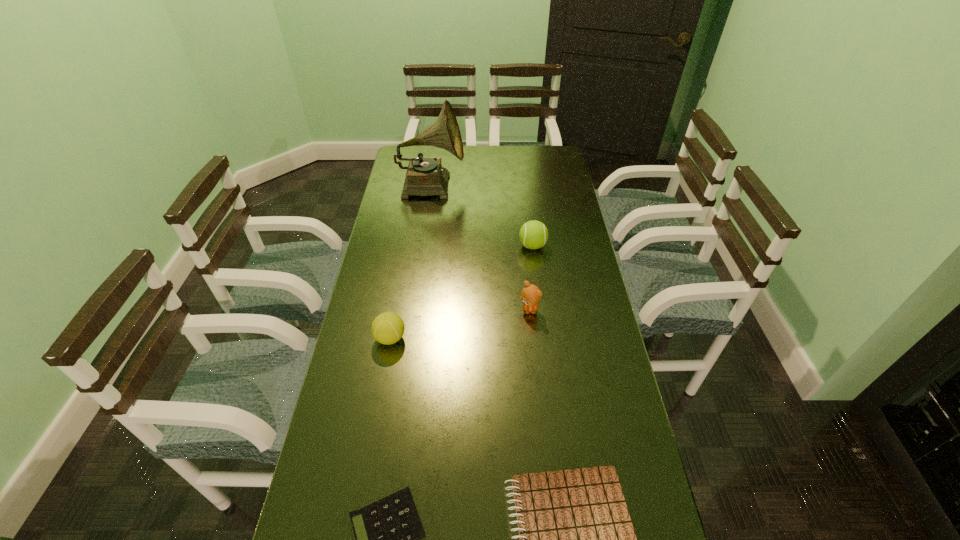
At what (x,y) coordinates should I click in order to perform the action: click on record player. Please return your answer as a coordinate pair (x, y). Looking at the image, I should click on (425, 176).

Locate an element on the screen. Image resolution: width=960 pixels, height=540 pixels. the tallest object is located at coordinates (425, 176).

Where is `teddy bear`? teddy bear is located at coordinates (531, 294).

Find the location of a particular element. Image resolution: width=960 pixels, height=540 pixels. the right tennis ball is located at coordinates (533, 234).

Find the location of a particular element. The width and height of the screenshot is (960, 540). the second farthest object is located at coordinates (533, 234).

At what (x,y) coordinates should I click in order to perform the action: click on the third nearest object. Please return your answer as a coordinate pair (x, y). The height and width of the screenshot is (540, 960). Looking at the image, I should click on click(387, 328).

Find the location of `the left tennis ball`. the left tennis ball is located at coordinates (387, 328).

This screenshot has height=540, width=960. I want to click on vacant space situated from the horn of the record player, so click(494, 185).

The image size is (960, 540). I want to click on vacant region located on the face of the fourth nearest object, so click(538, 389).

At what (x,y) coordinates should I click in order to perform the action: click on free location located on the left of the right tennis ball. Please return your answer as a coordinate pair (x, y). Looking at the image, I should click on (445, 246).